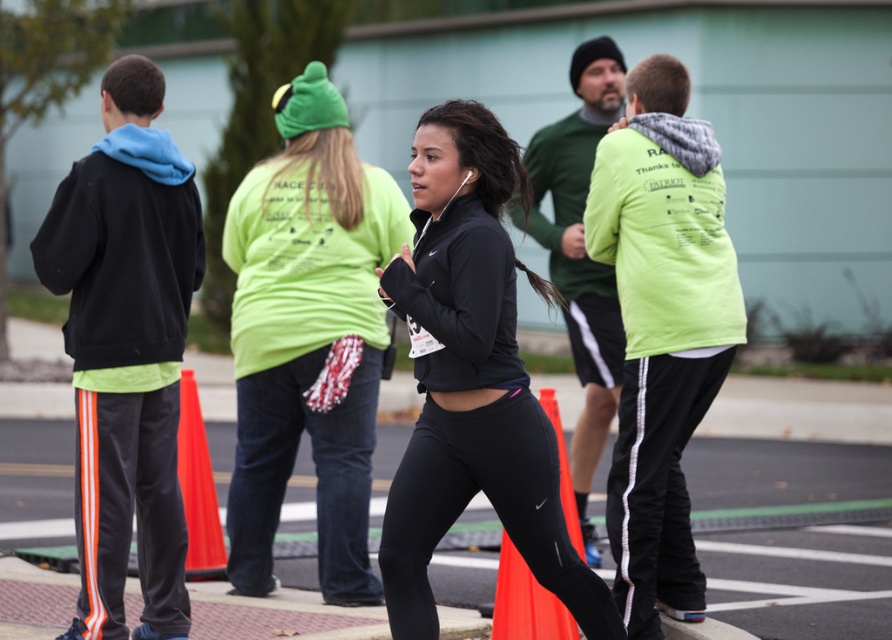
Question: Which object is farther from the camera taking this photo?

Choices:
 (A) matte black jacket at center
 (B) orange plastic cone at center
 (C) matte black leggings at center
 (D) black matte leggings at center

Answer: (A)

Question: Where is matte black jacket at center located in relation to orange fabric traffic cone at lower center in the image?

Choices:
 (A) above
 (B) below

Answer: (A)

Question: Does matte black leggings at center have a greater width compared to orange plastic cone at center?

Choices:
 (A) yes
 (B) no

Answer: (A)

Question: Which object is closer to the camera taking this photo?

Choices:
 (A) orange fabric traffic cone at lower center
 (B) black matte leggings at center

Answer: (B)

Question: Estimate the real-world distances between objects in this image. Which object is closer to the black matte leggings at center?

Choices:
 (A) black fleece jacket at left
 (B) neon green hoodie at upper right
 (C) black matte jacket at center
 (D) orange plastic cone at center

Answer: (C)

Question: Can you confirm if matte black leggings at center is wider than black matte leggings at center?

Choices:
 (A) yes
 (B) no

Answer: (A)